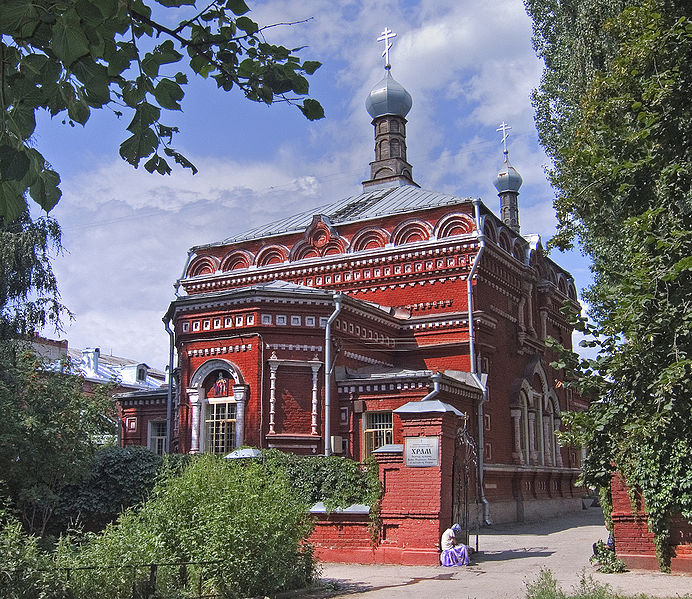
In order to click on floor in this screenshot , I will do `click(558, 561)`.